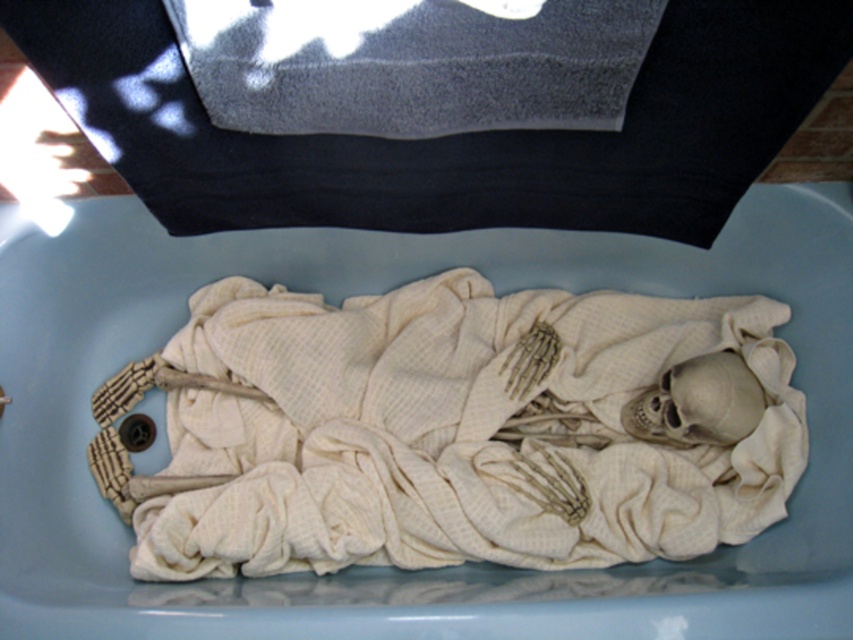
Does point (154, 349) lie behind point (798, 8)?

Yes.

Between point (833, 234) and point (722, 65), which one is positioned in front?

Positioned in front is point (722, 65).

This screenshot has width=853, height=640. In order to click on white fabric-covered skeleton at center in this screenshot , I will do `click(387, 566)`.